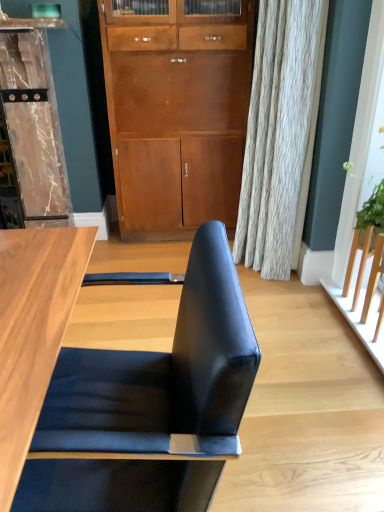
Question: Can you confirm if marble/textured dresser at left is taller than black leather chair at center?

Choices:
 (A) no
 (B) yes

Answer: (B)

Question: Is marble/textured dresser at left thinner than black leather chair at center?

Choices:
 (A) no
 (B) yes

Answer: (B)

Question: From a real-world perspective, is marble/textured dresser at left over black leather chair at center?

Choices:
 (A) no
 (B) yes

Answer: (B)

Question: Is marble/textured dresser at left touching black leather chair at center?

Choices:
 (A) no
 (B) yes

Answer: (A)

Question: Can you confirm if marble/textured dresser at left is positioned to the right of black leather chair at center?

Choices:
 (A) yes
 (B) no

Answer: (B)

Question: Is marble/textured dresser at left outside of black leather chair at center?

Choices:
 (A) yes
 (B) no

Answer: (A)

Question: Does marble/textured dresser at left have a lesser height compared to matte wood cabinet at center?

Choices:
 (A) no
 (B) yes

Answer: (B)

Question: Is marble/textured dresser at left facing away from matte wood cabinet at center?

Choices:
 (A) yes
 (B) no

Answer: (B)

Question: From the image's perspective, is marble/textured dresser at left under matte wood cabinet at center?

Choices:
 (A) yes
 (B) no

Answer: (A)

Question: From the image's perspective, is marble/textured dresser at left on top of matte wood cabinet at center?

Choices:
 (A) yes
 (B) no

Answer: (B)

Question: Can you confirm if marble/textured dresser at left is positioned to the left of matte wood cabinet at center?

Choices:
 (A) yes
 (B) no

Answer: (A)

Question: Is marble/textured dresser at left smaller than matte wood cabinet at center?

Choices:
 (A) yes
 (B) no

Answer: (A)

Question: Could you tell me if black leather chair at center is turned towards marble/textured dresser at left?

Choices:
 (A) no
 (B) yes

Answer: (A)